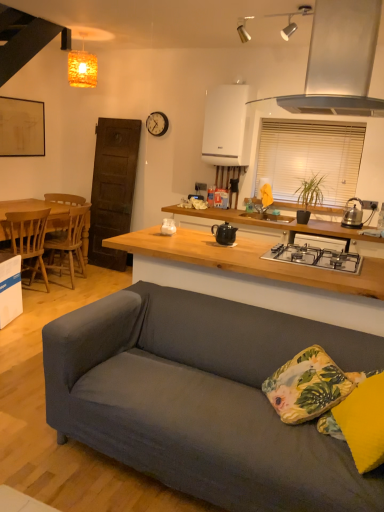
Locate an element on the screen. Image resolution: width=384 pixels, height=512 pixels. empty space that is to the right of black ceramic teapot at center is located at coordinates pyautogui.click(x=258, y=244).